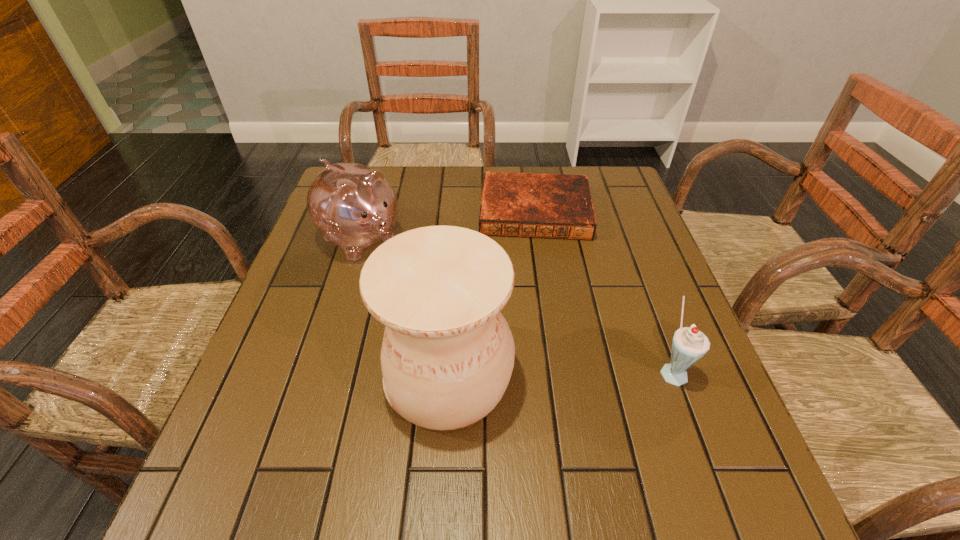
This screenshot has height=540, width=960. I want to click on object that is positioned at the far right corner, so click(x=555, y=206).

The height and width of the screenshot is (540, 960). Identify the location of vacant space at the far edge. (447, 168).

This screenshot has height=540, width=960. Find the location of `free space at the near edge`. free space at the near edge is located at coordinates (508, 452).

Find the location of `vacant area at the left edge of the desktop`. vacant area at the left edge of the desktop is located at coordinates (348, 267).

At what (x,y) coordinates should I click in order to perform the action: click on free space at the right edge of the desktop. Please return your answer as a coordinate pair (x, y). Image resolution: width=960 pixels, height=540 pixels. Looking at the image, I should click on (649, 242).

Image resolution: width=960 pixels, height=540 pixels. What are the coordinates of `vacant area at the far right corner` in the screenshot? It's located at (612, 170).

What are the coordinates of `vacant space in between the second tallest object and the Bible` in the screenshot? It's located at (448, 225).

What are the coordinates of `unoccupied position between the rightmost object and the second tallest object` in the screenshot? It's located at (516, 304).

Image resolution: width=960 pixels, height=540 pixels. Identify the location of vacant point located between the third shortest object and the rightmost object. (516, 304).

Locate an element on the screen. The width and height of the screenshot is (960, 540). vacant space that is in between the Bible and the second tallest object is located at coordinates (448, 225).